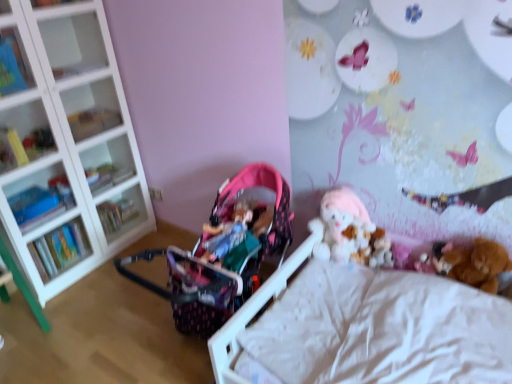
Question: From the image's perspective, is matte plastic books at left, the first shelf when ordered from bottom to top, located above clear glass shelves at left, the fourth shelf in the top-to-bottom sequence?

Choices:
 (A) no
 (B) yes

Answer: (A)

Question: Considering the relative sizes of matte plastic books at left, positioned as the 5th shelf in top-to-bottom order, and clear glass shelves at left, the fourth shelf in the top-to-bottom sequence, in the image provided, is matte plastic books at left, positioned as the 5th shelf in top-to-bottom order, shorter than clear glass shelves at left, the fourth shelf in the top-to-bottom sequence,?

Choices:
 (A) yes
 (B) no

Answer: (B)

Question: From a real-world perspective, is matte plastic books at left, positioned as the 5th shelf in top-to-bottom order, positioned under clear glass shelves at left, which ranks as the 2th shelf in bottom-to-top order, based on gravity?

Choices:
 (A) yes
 (B) no

Answer: (B)

Question: Considering the relative sizes of matte plastic books at left, the first shelf when ordered from bottom to top, and clear glass shelves at left, which ranks as the 2th shelf in bottom-to-top order, in the image provided, is matte plastic books at left, the first shelf when ordered from bottom to top, taller than clear glass shelves at left, which ranks as the 2th shelf in bottom-to-top order,?

Choices:
 (A) no
 (B) yes

Answer: (B)

Question: Considering the relative sizes of matte plastic books at left, positioned as the 5th shelf in top-to-bottom order, and clear glass shelves at left, which ranks as the 2th shelf in bottom-to-top order, in the image provided, is matte plastic books at left, positioned as the 5th shelf in top-to-bottom order, wider than clear glass shelves at left, which ranks as the 2th shelf in bottom-to-top order,?

Choices:
 (A) yes
 (B) no

Answer: (A)

Question: Would you say matte plastic books at left, positioned as the 5th shelf in top-to-bottom order, is outside clear glass shelves at left, the fourth shelf in the top-to-bottom sequence?

Choices:
 (A) no
 (B) yes

Answer: (B)

Question: Is matte plastic books at left, positioned as the 5th shelf in top-to-bottom order, directly adjacent to clear glass shelf at upper left, placed as the 4th shelf when sorted from bottom to top?

Choices:
 (A) yes
 (B) no

Answer: (B)

Question: Can you confirm if matte plastic books at left, positioned as the 5th shelf in top-to-bottom order, is positioned to the right of clear glass shelf at upper left, arranged as the 2th shelf when viewed from the top?

Choices:
 (A) no
 (B) yes

Answer: (A)

Question: Is matte plastic books at left, positioned as the 5th shelf in top-to-bottom order, closer to camera compared to clear glass shelf at upper left, placed as the 4th shelf when sorted from bottom to top?

Choices:
 (A) no
 (B) yes

Answer: (B)

Question: Does matte plastic books at left, the first shelf when ordered from bottom to top, have a greater height compared to clear glass shelf at upper left, placed as the 4th shelf when sorted from bottom to top?

Choices:
 (A) yes
 (B) no

Answer: (A)

Question: Is matte plastic books at left, the first shelf when ordered from bottom to top, to the left of clear glass shelf at upper left, arranged as the 2th shelf when viewed from the top, from the viewer's perspective?

Choices:
 (A) no
 (B) yes

Answer: (B)

Question: From the image's perspective, is matte plastic books at left, positioned as the 5th shelf in top-to-bottom order, beneath clear glass shelf at upper left, arranged as the 2th shelf when viewed from the top?

Choices:
 (A) yes
 (B) no

Answer: (A)

Question: Can you see pink fabric baby carriage at center touching clear glass shelves at left, the fourth shelf in the top-to-bottom sequence?

Choices:
 (A) no
 (B) yes

Answer: (A)